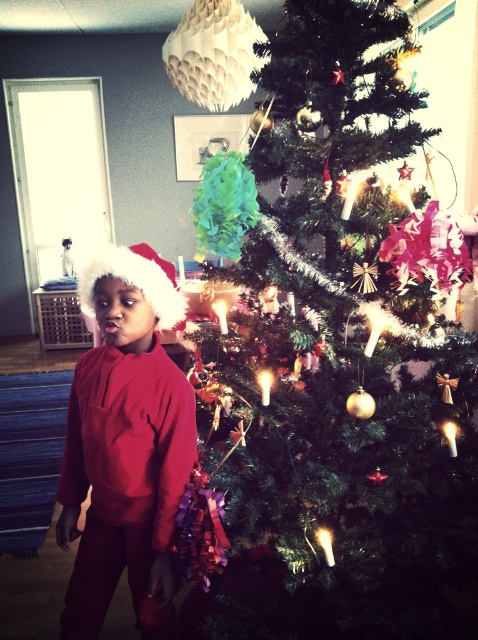
You are a toy elf who wants to place a new ornament on the tallest object in the scene. Which object should you choose between the green shiny christmas tree at center and the fuzzy fabric santa hat at left?

The green shiny christmas tree at center is bigger than the fuzzy fabric santa hat at left, so the elf should place the ornament on the green shiny christmas tree at center.

You are a photographer standing in front of the Christmas tree. You want to take a photo of the matte red sweater at center without any foreground objects blocking it. Is the distance sufficient to ensure the sweater is in focus and unobstructed?

The matte red sweater at center is 1.29 meters from the camera, which is a sufficient distance to ensure it is in focus and unobstructed as there are no foreground objects mentioned in the scene that would block it.